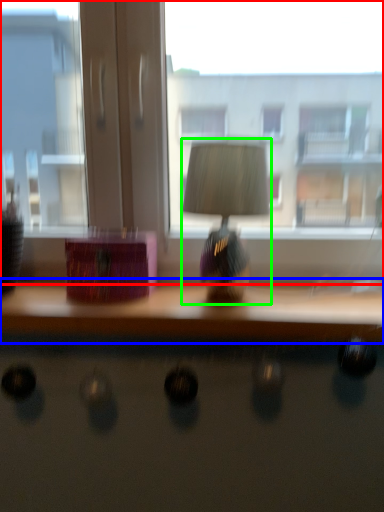
Question: Based on their relative distances, which object is nearer to window (highlighted by a red box)? Choose from table (highlighted by a blue box) and table lamp (highlighted by a green box).

Choices:
 (A) table
 (B) table lamp

Answer: (B)